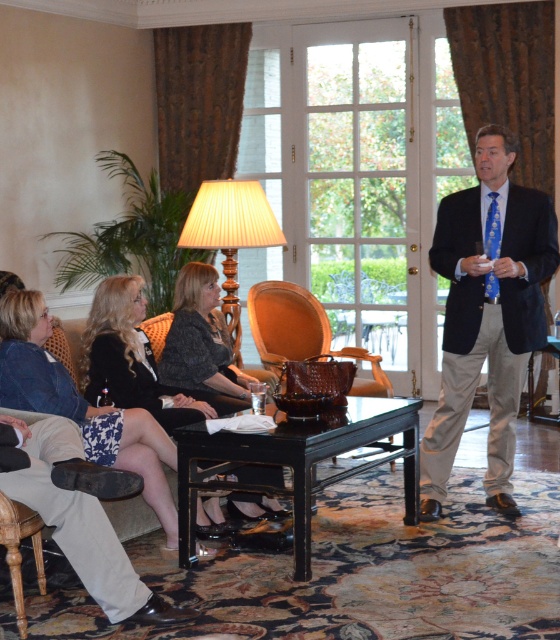
Is beige fabric lampshade at center further to camera compared to brown leather armchair at center?

No, it is not.

Locate an element on the screen. The width and height of the screenshot is (560, 640). beige fabric lampshade at center is located at coordinates (230, 234).

Where is `beige fabric lampshade at center`? The width and height of the screenshot is (560, 640). beige fabric lampshade at center is located at coordinates (230, 234).

Can you confirm if denim jacket at lower left is positioned to the right of beige fabric lampshade at center?

No, denim jacket at lower left is not to the right of beige fabric lampshade at center.

Between denim jacket at lower left and beige fabric lampshade at center, which one has less height?

Standing shorter between the two is beige fabric lampshade at center.

Where is `denim jacket at lower left`? Image resolution: width=560 pixels, height=640 pixels. denim jacket at lower left is located at coordinates (81, 404).

Does denim jacket at lower left have a greater height compared to black textured dress at center?

Yes.

The image size is (560, 640). What do you see at coordinates (81, 404) in the screenshot?
I see `denim jacket at lower left` at bounding box center [81, 404].

Is point (95, 433) behind point (174, 304)?

No, it is not.

Where is `denim jacket at lower left`? Image resolution: width=560 pixels, height=640 pixels. denim jacket at lower left is located at coordinates (81, 404).